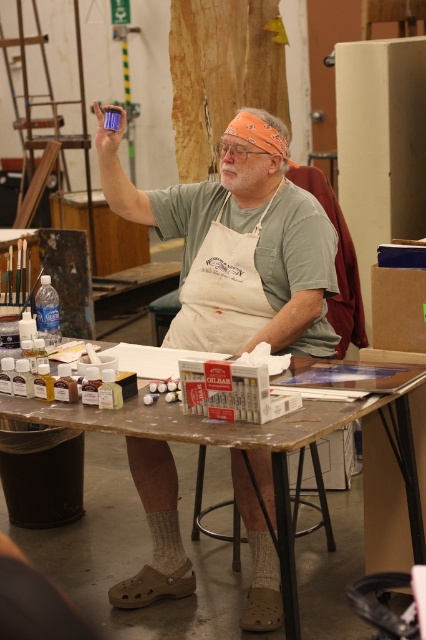
Question: Is matte green shirt at center closer to camera compared to wooden table at center?

Choices:
 (A) yes
 (B) no

Answer: (B)

Question: Is matte green shirt at center thinner than wooden table at center?

Choices:
 (A) yes
 (B) no

Answer: (A)

Question: Does matte green shirt at center lie behind wooden table at center?

Choices:
 (A) no
 (B) yes

Answer: (B)